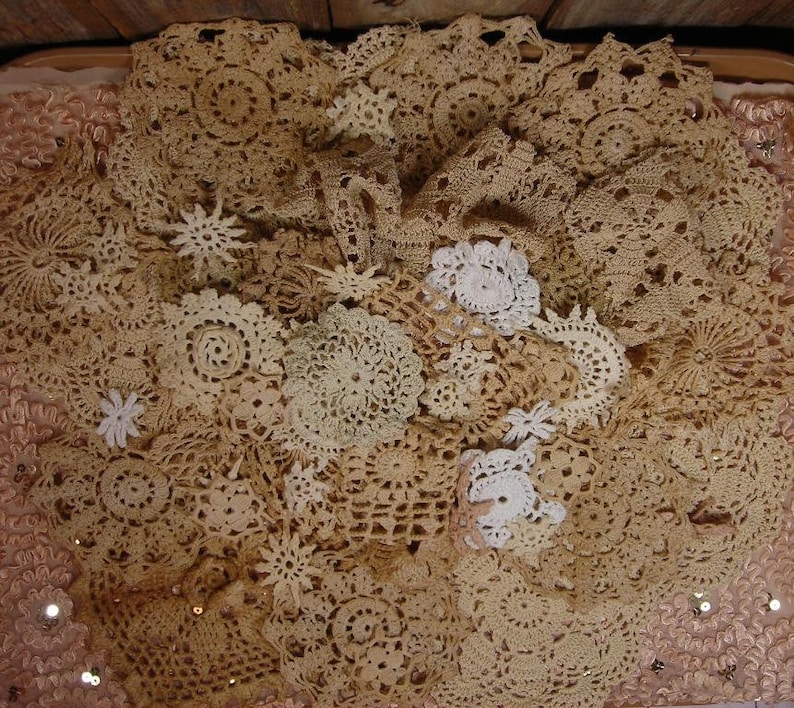
At what (x,y) coordinates should I click in order to perform the action: click on yellowish net like fabric. Please return your answer as a coordinate pair (x, y). The image size is (794, 708). Looking at the image, I should click on (163, 687).